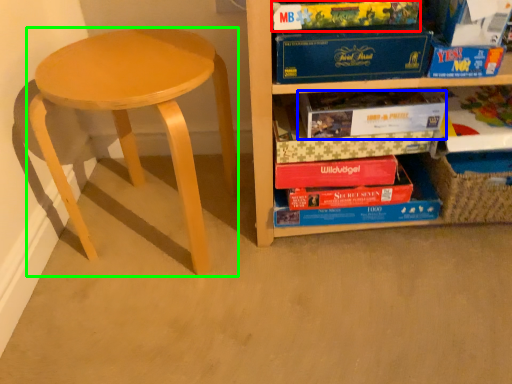
Question: Which object is the farthest from paperback book (highlighted by a red box)? Choose among these: paperback book (highlighted by a blue box) or stool (highlighted by a green box).

Choices:
 (A) paperback book
 (B) stool

Answer: (B)